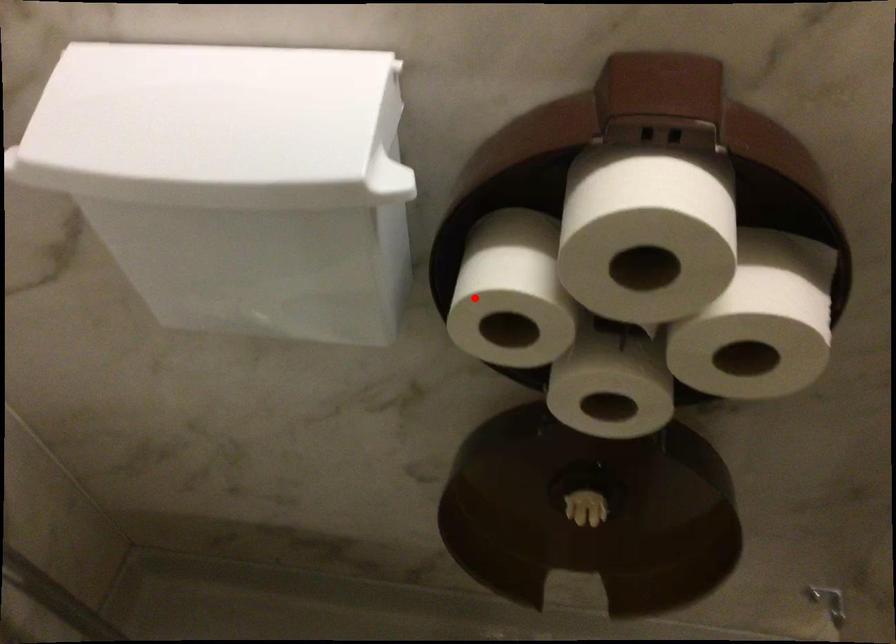
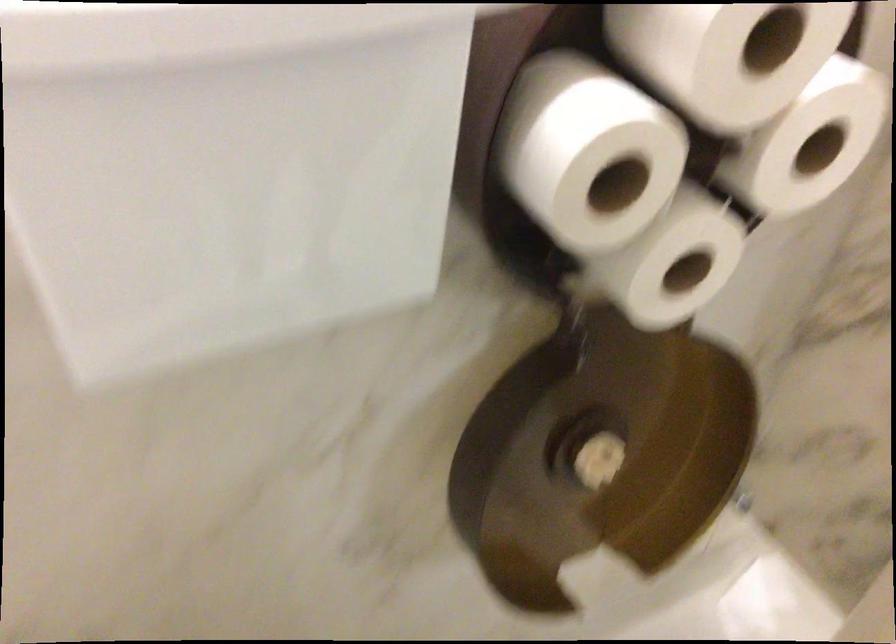
Question: I am providing you with two images of the same scene from different viewpoints. A red point is shown in image1. For the corresponding object point in image2, is it positioned nearer or farther from the camera?

Choices:
 (A) Nearer
 (B) Farther

Answer: (A)